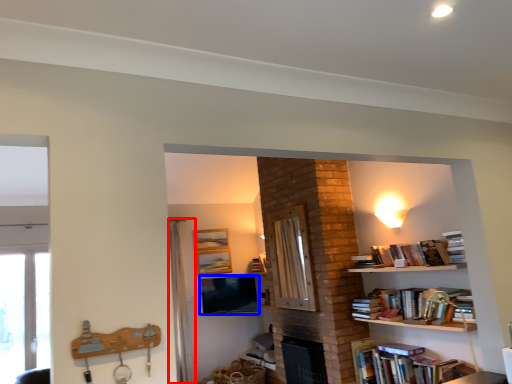
Question: Which object is closer to the camera taking this photo, curtain (highlighted by a red box) or television (highlighted by a blue box)?

Choices:
 (A) curtain
 (B) television

Answer: (A)